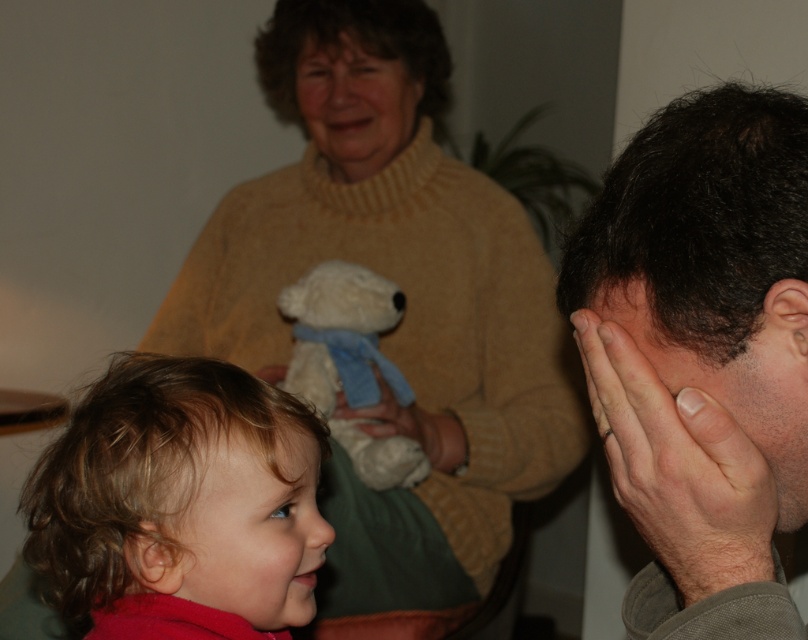
Can you confirm if smooth red face at lower left is smaller than knitted yellow sweater at upper center?

Yes, smooth red face at lower left is smaller than knitted yellow sweater at upper center.

Looking at this image, is smooth red face at lower left to the right of knitted yellow sweater at upper center from the viewer's perspective?

Yes, smooth red face at lower left is to the right of knitted yellow sweater at upper center.

At what (x,y) coordinates should I click in order to perform the action: click on smooth red face at lower left. Please return your answer as a coordinate pair (x, y). Looking at the image, I should click on (251, 531).

You are a GUI agent. You are given a task and a screenshot of the screen. Output one action in this format:
    pyautogui.click(x=<x>, y=<y>)
    Task: Click on the smooth red face at lower left
    
    Given the screenshot: What is the action you would take?
    pyautogui.click(x=251, y=531)

Can you confirm if knitted yellow sweater at upper center is positioned below smooth skin nose at lower left?

No.

Is knitted yellow sweater at upper center taller than smooth skin nose at lower left?

Yes.

Which is in front, point (436, 67) or point (306, 536)?

Point (306, 536)

Where is `knitted yellow sweater at upper center`? This screenshot has width=808, height=640. knitted yellow sweater at upper center is located at coordinates (360, 45).

Who is higher up, dark brown hair at right or smooth skin hands at right?

dark brown hair at right is higher up.

Is dark brown hair at right to the left of smooth skin hands at right from the viewer's perspective?

Incorrect, dark brown hair at right is not on the left side of smooth skin hands at right.

Who is more distant from viewer, (718,86) or (739,474)?

Positioned behind is point (718,86).

Locate an element on the screen. This screenshot has width=808, height=640. dark brown hair at right is located at coordinates (697, 355).